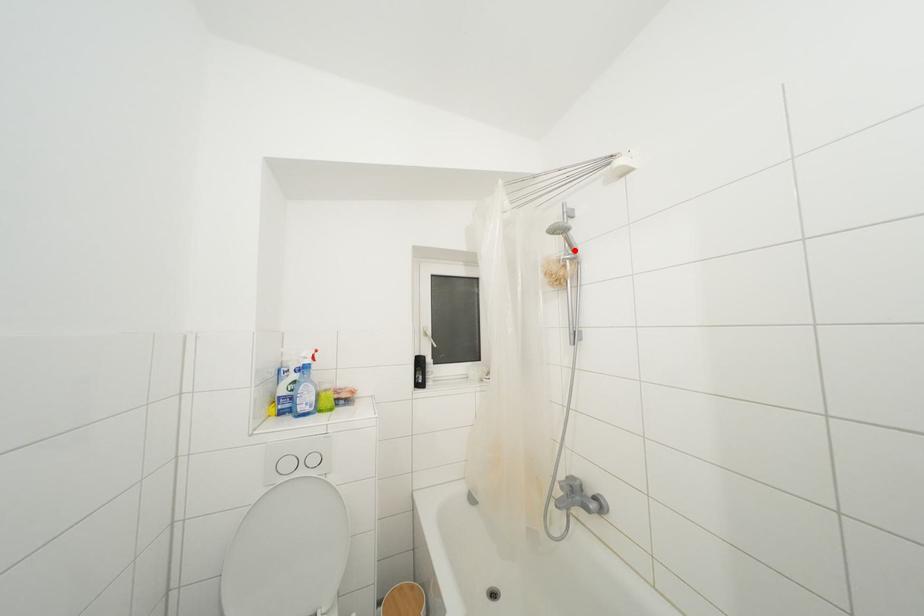
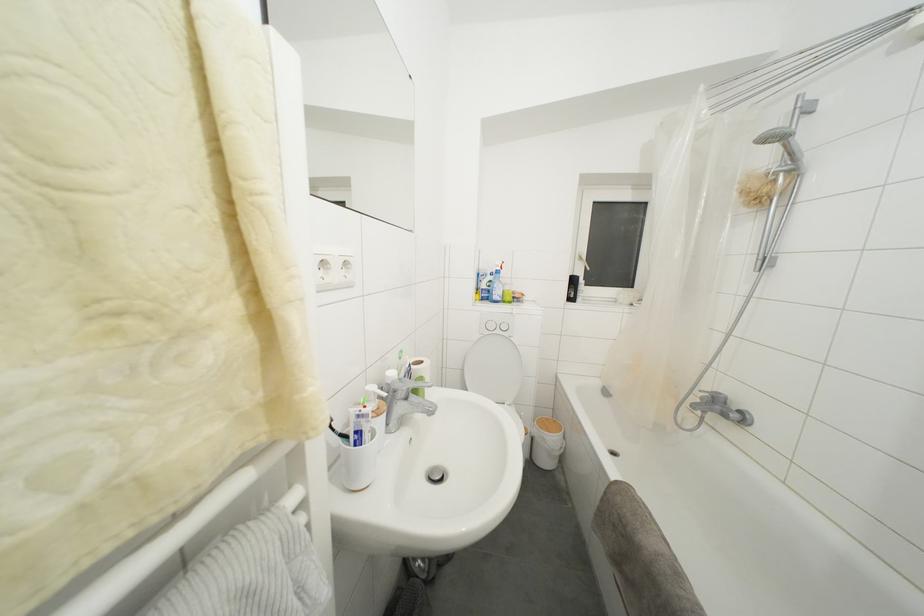
Question: I am providing you with two images of the same scene from different viewpoints. A red point is marked on the first image. Can you still see the location of the red point in image 2?

Choices:
 (A) Yes
 (B) No

Answer: (A)